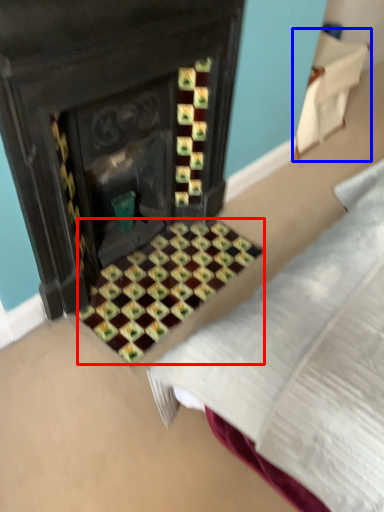
Question: Which object is further to the camera taking this photo, pattern (highlighted by a red box) or furniture (highlighted by a blue box)?

Choices:
 (A) pattern
 (B) furniture

Answer: (B)